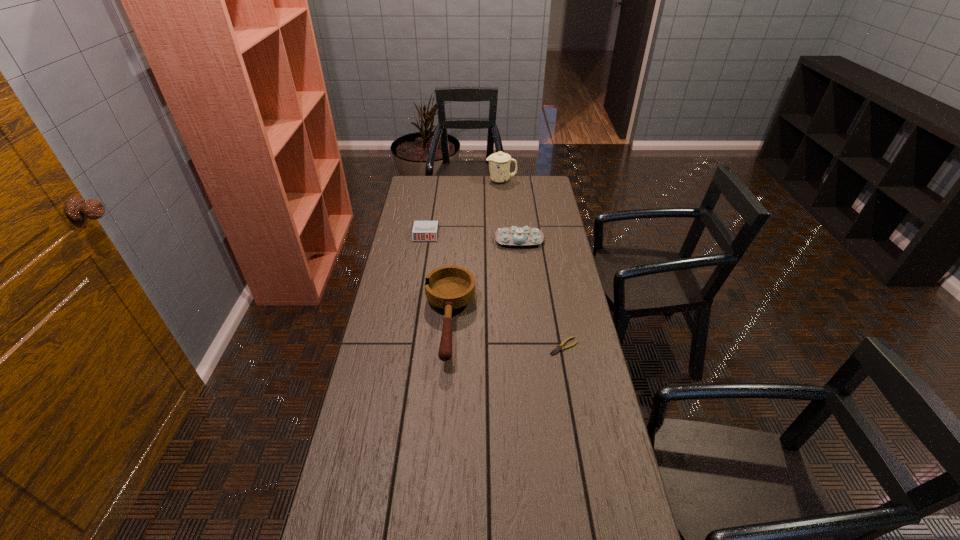
You are a GUI agent. You are given a task and a screenshot of the screen. Output one action in this format:
    pyautogui.click(x=<x>, y=<y>)
    Task: Click on the free point between the saucepan and the nearer chinaware
    Image resolution: width=960 pixels, height=540 pixels.
    Given the screenshot: What is the action you would take?
    pyautogui.click(x=484, y=281)

This screenshot has height=540, width=960. I want to click on free space between the taller chinaware and the alarm clock, so click(464, 207).

I want to click on blank region between the shortest object and the nearer chinaware, so click(x=541, y=293).

In order to click on free area in between the tallest object and the fourth tallest object in this screenshot , I will do `click(464, 207)`.

Locate an element on the screen. The height and width of the screenshot is (540, 960). vacant space that's between the second shortest object and the shorter chinaware is located at coordinates (472, 237).

Find the location of `empty space that is in between the shorter chinaware and the shortest object`. empty space that is in between the shorter chinaware and the shortest object is located at coordinates (541, 293).

Find the location of a particular element. The height and width of the screenshot is (540, 960). free space between the shorter chinaware and the taller chinaware is located at coordinates 510,210.

Locate an element on the screen. empty space between the tallest object and the nearer chinaware is located at coordinates (510, 210).

This screenshot has height=540, width=960. Find the location of `free space between the saucepan and the nearer chinaware`. free space between the saucepan and the nearer chinaware is located at coordinates (484, 281).

Where is `free space that is in between the pliers and the taller chinaware`? This screenshot has width=960, height=540. free space that is in between the pliers and the taller chinaware is located at coordinates (533, 264).